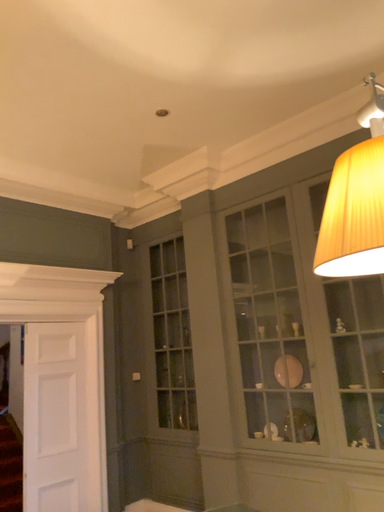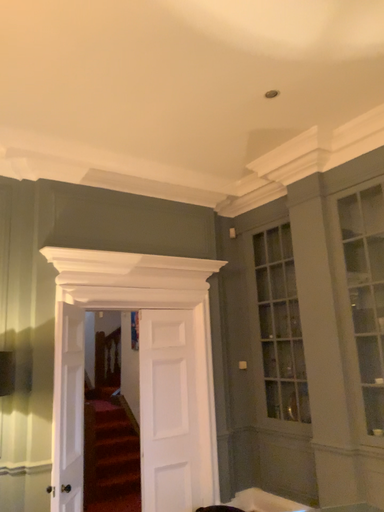
Question: How did the camera likely rotate when shooting the video?

Choices:
 (A) rotated left
 (B) rotated right

Answer: (A)